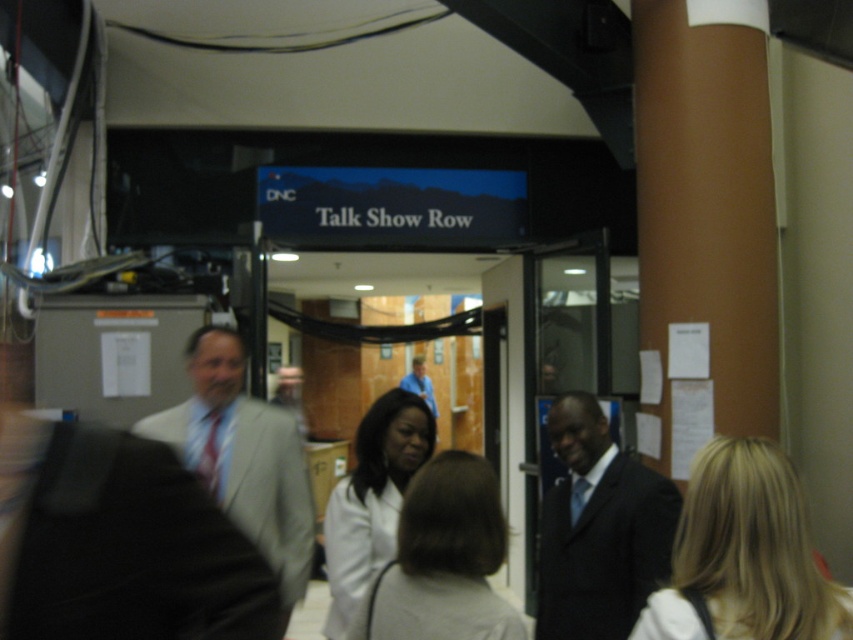
Does dark blue suit at center have a greater width compared to light brown hair at center?

Yes.

Does dark blue suit at center appear on the right side of light brown hair at center?

Correct, you'll find dark blue suit at center to the right of light brown hair at center.

This screenshot has height=640, width=853. I want to click on dark blue suit at center, so click(599, 529).

Identify the location of dark blue suit at center. (599, 529).

Is light gray fabric business suit at center bigger than dark blue suit at center?

Actually, light gray fabric business suit at center might be smaller than dark blue suit at center.

Who is positioned more to the right, light gray fabric business suit at center or dark blue suit at center?

Positioned to the right is dark blue suit at center.

Identify the location of light gray fabric business suit at center. (119, 544).

Does blonde hair at upper right appear over dark blue suit at center?

Indeed, blonde hair at upper right is positioned over dark blue suit at center.

Consider the image. Does blonde hair at upper right appear on the right side of dark blue suit at center?

Correct, you'll find blonde hair at upper right to the right of dark blue suit at center.

This screenshot has height=640, width=853. I want to click on blonde hair at upper right, so click(x=746, y=554).

You are a GUI agent. You are given a task and a screenshot of the screen. Output one action in this format:
    pyautogui.click(x=<x>, y=<y>)
    Task: Click on the blonde hair at upper right
    
    Given the screenshot: What is the action you would take?
    pyautogui.click(x=746, y=554)